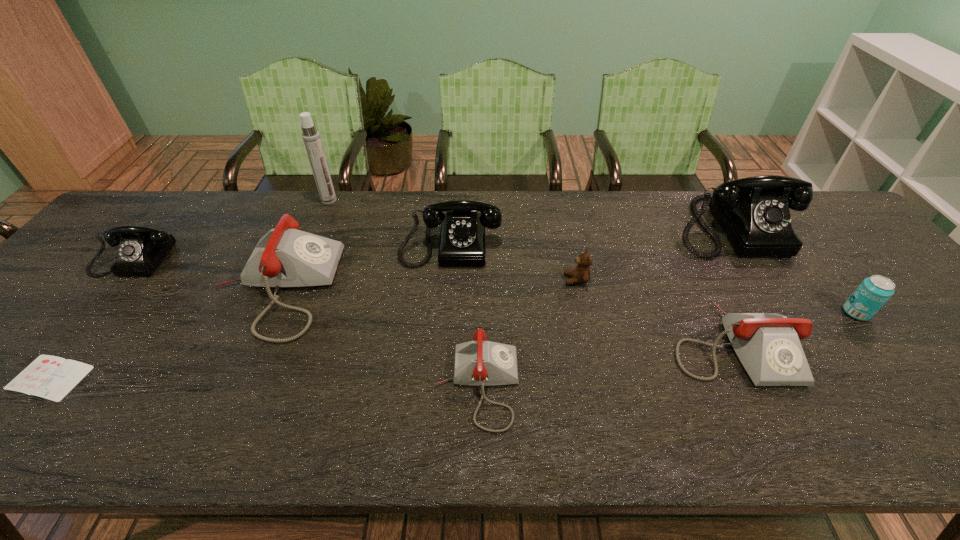
Locate an element on the screen. This screenshot has width=960, height=540. beer can is located at coordinates (875, 291).

This screenshot has height=540, width=960. I want to click on the fourth object from right to left, so click(581, 274).

Where is `the rightmost red telephone`? the rightmost red telephone is located at coordinates (768, 345).

Find the location of a particular element. The height and width of the screenshot is (540, 960). the second red telephone from left to right is located at coordinates (481, 363).

I want to click on the shortest telephone, so click(x=481, y=363).

This screenshot has height=540, width=960. In order to click on vacant space located 0.110m on the front of the white aerosol can in this screenshot , I will do click(319, 226).

Identify the location of vacant area located 0.270m on the dial of the tallest telephone. (802, 339).

Where is `free region located 0.170m on the dial of the second smallest black telephone`? The height and width of the screenshot is (540, 960). free region located 0.170m on the dial of the second smallest black telephone is located at coordinates (445, 318).

What are the coordinates of `vacant region located 0.110m on the dial of the biggest red telephone` in the screenshot? It's located at (375, 288).

This screenshot has height=540, width=960. Find the location of `vacant space located on the dial of the leftmost black telephone`. vacant space located on the dial of the leftmost black telephone is located at coordinates (41, 380).